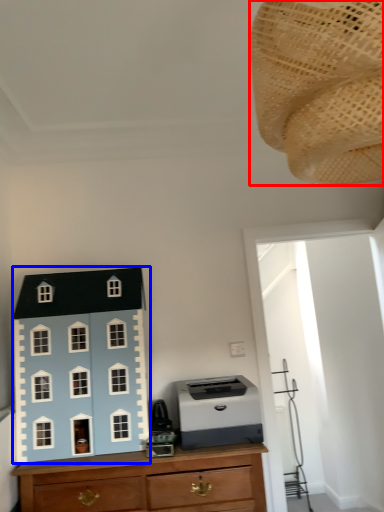
Question: Which object appears farthest to the camera in this image, toy (highlighted by a red box) or toy (highlighted by a blue box)?

Choices:
 (A) toy
 (B) toy

Answer: (B)